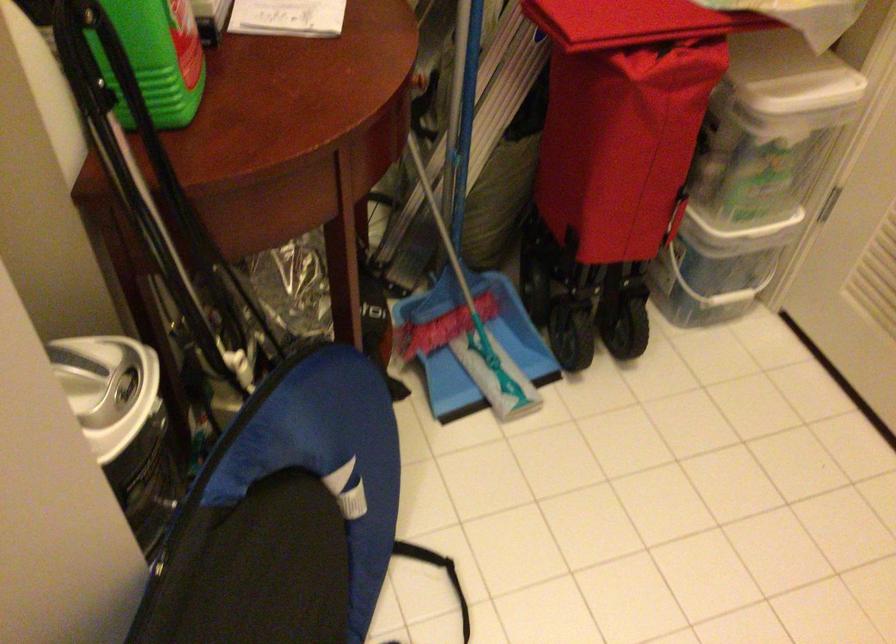
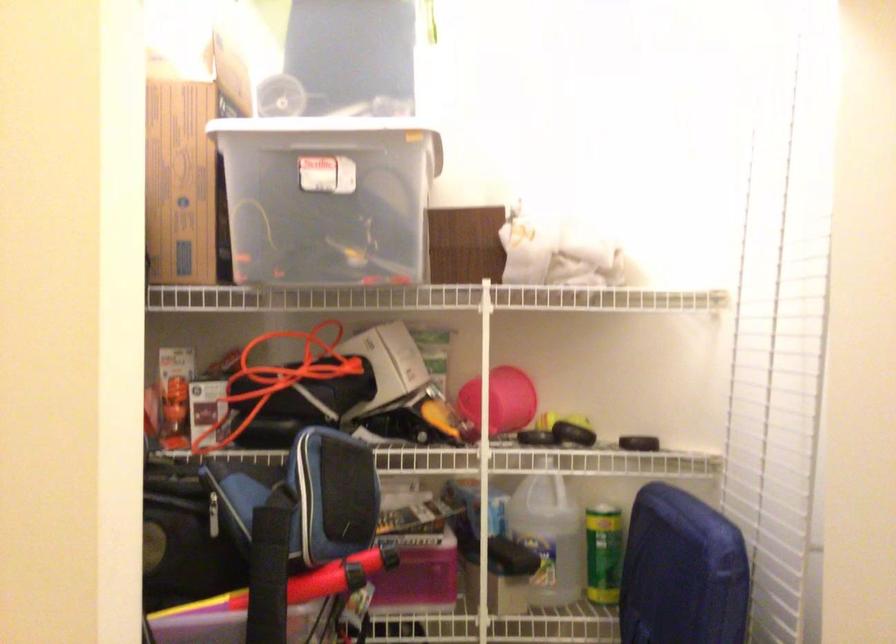
Question: The camera is either moving clockwise (left) or counter-clockwise (right) around the object. The first image is from the beginning of the video and the second image is from the end. Is the camera moving left or right when shooting the video?

Choices:
 (A) Left
 (B) Right

Answer: (B)